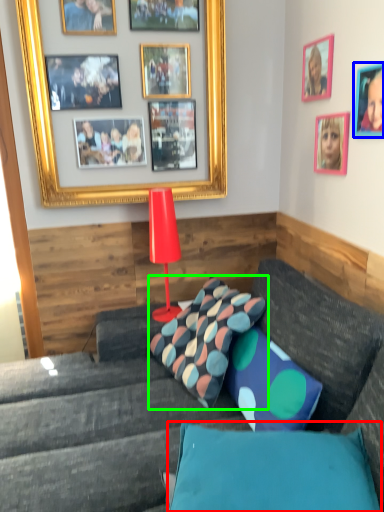
Question: Estimate the real-world distances between objects in this image. Which object is farther from pillow (highlighted by a red box), picture frame (highlighted by a blue box) or pillow (highlighted by a green box)?

Choices:
 (A) picture frame
 (B) pillow

Answer: (A)